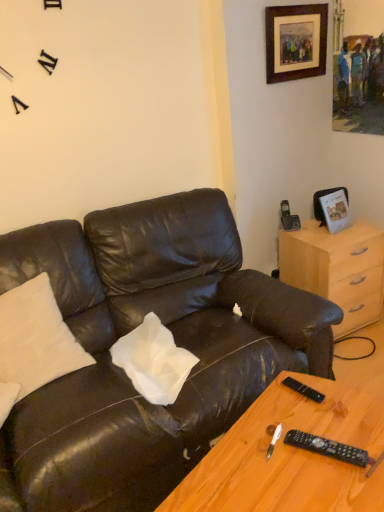
Locate an element on the screen. free space to the left of black plastic remote at lower right, positioned as the 2th remote in bottom-to-top order is located at coordinates pos(268,410).